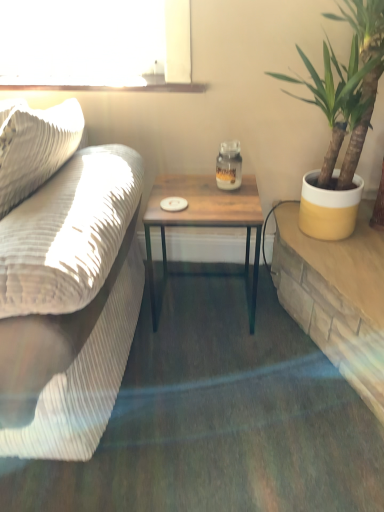
Question: Does clear glass window sill at upper center have a greater width compared to wooden table at right?

Choices:
 (A) no
 (B) yes

Answer: (A)

Question: Is clear glass window sill at upper center taller than wooden table at right?

Choices:
 (A) no
 (B) yes

Answer: (A)

Question: Is clear glass window sill at upper center at the left side of wooden table at right?

Choices:
 (A) yes
 (B) no

Answer: (A)

Question: Would you say clear glass window sill at upper center contains wooden table at right?

Choices:
 (A) yes
 (B) no

Answer: (B)

Question: Is clear glass window sill at upper center next to wooden table at right and touching it?

Choices:
 (A) yes
 (B) no

Answer: (B)

Question: Is clear glass window sill at upper center thinner than wooden table at right?

Choices:
 (A) no
 (B) yes

Answer: (B)

Question: Is yellow ceramic pot at right facing away from matte beige couch at left?

Choices:
 (A) yes
 (B) no

Answer: (B)

Question: Considering the relative positions of yellow ceramic pot at right and matte beige couch at left in the image provided, is yellow ceramic pot at right to the left of matte beige couch at left from the viewer's perspective?

Choices:
 (A) yes
 (B) no

Answer: (B)

Question: From the image's perspective, does yellow ceramic pot at right appear higher than matte beige couch at left?

Choices:
 (A) yes
 (B) no

Answer: (A)

Question: Is yellow ceramic pot at right smaller than matte beige couch at left?

Choices:
 (A) no
 (B) yes

Answer: (B)

Question: Is yellow ceramic pot at right thinner than matte beige couch at left?

Choices:
 (A) yes
 (B) no

Answer: (A)

Question: Considering the relative sizes of yellow ceramic pot at right and matte beige couch at left in the image provided, is yellow ceramic pot at right wider than matte beige couch at left?

Choices:
 (A) no
 (B) yes

Answer: (A)

Question: Considering the relative positions of wooden table at center and yellow ceramic pot at right in the image provided, is wooden table at center to the left of yellow ceramic pot at right from the viewer's perspective?

Choices:
 (A) yes
 (B) no

Answer: (A)